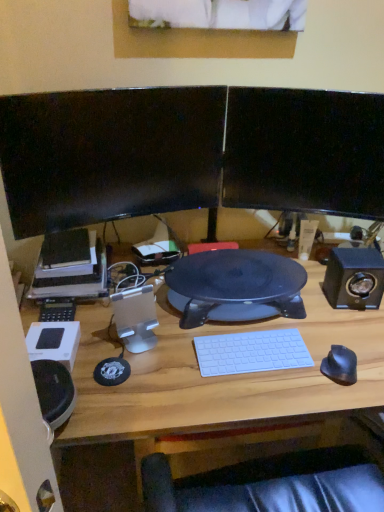
Locate an element on the screen. unoccupied area in front of black plastic desk at center is located at coordinates (223, 378).